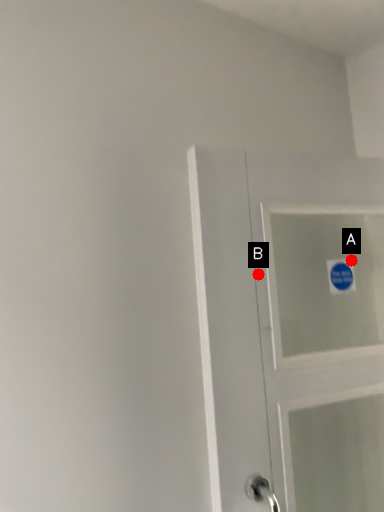
Question: Two points are circled on the image, labeled by A and B beside each circle. Among these points, which one is farthest from the camera?

Choices:
 (A) A is further
 (B) B is further

Answer: (A)